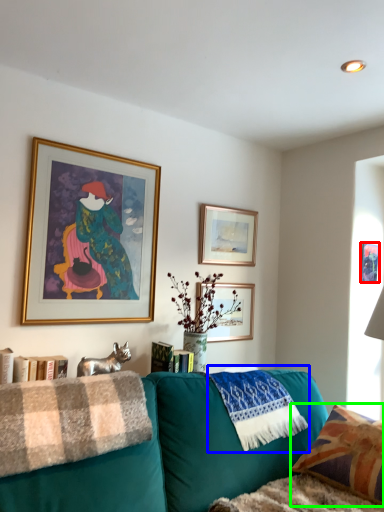
Question: Considering the real-world distances, which object is farthest from picture frame (highlighted by a red box)? material (highlighted by a blue box) or pillow (highlighted by a green box)?

Choices:
 (A) material
 (B) pillow

Answer: (B)